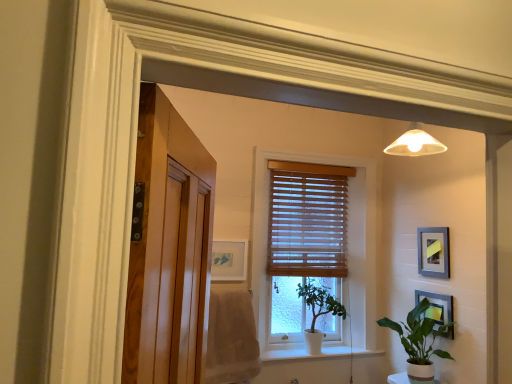
Question: From a real-world perspective, is wooden blinds at center positioned over matte white picture frame at center, which is counted as the 1th picture frame, starting from the left, based on gravity?

Choices:
 (A) no
 (B) yes

Answer: (B)

Question: Is wooden blinds at center at the right side of matte white picture frame at center, which is counted as the 1th picture frame, starting from the left?

Choices:
 (A) no
 (B) yes

Answer: (B)

Question: Is there a large distance between wooden blinds at center and matte white picture frame at center, the third picture frame positioned from the right?

Choices:
 (A) no
 (B) yes

Answer: (A)

Question: Considering the relative sizes of wooden blinds at center and matte white picture frame at center, the third picture frame positioned from the right, in the image provided, is wooden blinds at center smaller than matte white picture frame at center, the third picture frame positioned from the right,?

Choices:
 (A) yes
 (B) no

Answer: (B)

Question: From the image's perspective, is wooden blinds at center located above matte white picture frame at center, the third picture frame positioned from the right?

Choices:
 (A) no
 (B) yes

Answer: (B)

Question: Looking at their shapes, would you say green glossy houseplant at lower right, which is the second houseplant from left to right, is wider or thinner than metallic silver picture frame at lower right, the 2th picture frame when ordered from left to right?

Choices:
 (A) thin
 (B) wide

Answer: (B)

Question: Visually, is green glossy houseplant at lower right, positioned as the second houseplant in back-to-front order, positioned to the left or to the right of metallic silver picture frame at lower right, the second picture frame when ordered from right to left?

Choices:
 (A) left
 (B) right

Answer: (A)

Question: In the image, is green glossy houseplant at lower right, which is the second houseplant from left to right, positioned in front of or behind metallic silver picture frame at lower right, the second picture frame when ordered from right to left?

Choices:
 (A) front
 (B) behind

Answer: (A)

Question: Is green glossy houseplant at lower right, positioned as the second houseplant in back-to-front order, situated inside metallic silver picture frame at lower right, the second picture frame when ordered from right to left, or outside?

Choices:
 (A) inside
 (B) outside

Answer: (B)

Question: From the image's perspective, relative to green matte plant at center, which is the 1th houseplant from left to right, is green glossy houseplant at lower right, which is the second houseplant from left to right, above or below?

Choices:
 (A) below
 (B) above

Answer: (A)

Question: In terms of height, does green glossy houseplant at lower right, positioned as the second houseplant in back-to-front order, look taller or shorter compared to green matte plant at center, marked as the 1th houseplant in a back-to-front arrangement?

Choices:
 (A) short
 (B) tall

Answer: (B)

Question: Is green glossy houseplant at lower right, which is the second houseplant from left to right, wider or thinner than green matte plant at center, positioned as the second houseplant in front-to-back order?

Choices:
 (A) thin
 (B) wide

Answer: (A)

Question: From a real-world perspective, is green glossy houseplant at lower right, which is the second houseplant from left to right, physically located above or below green matte plant at center, which is the 1th houseplant from left to right?

Choices:
 (A) below
 (B) above

Answer: (A)

Question: Considering the positions of beige cotton bath towel at left and gray matte picture frame at upper right, which is the 1th picture frame in right-to-left order, in the image, is beige cotton bath towel at left taller or shorter than gray matte picture frame at upper right, which is the 1th picture frame in right-to-left order,?

Choices:
 (A) short
 (B) tall

Answer: (B)

Question: From a real-world perspective, is beige cotton bath towel at left physically located above or below gray matte picture frame at upper right, which is the 1th picture frame in right-to-left order?

Choices:
 (A) above
 (B) below

Answer: (B)